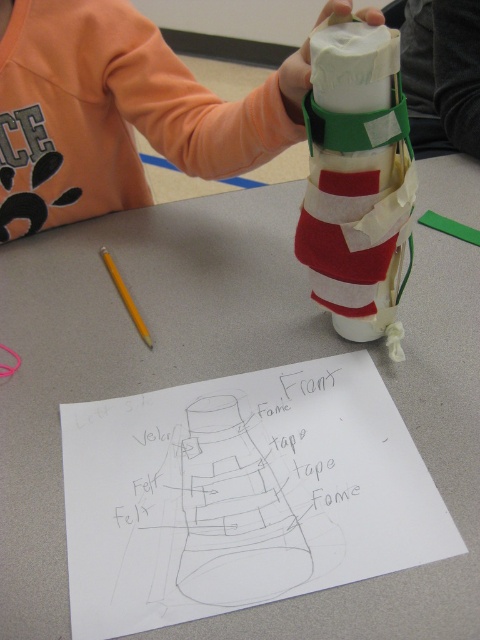
You are organizing a classroom supply closet. You have a shelf that can only hold items smaller than the yellow wood pencil at left. Can the white matte paper towel roll at center be placed on this shelf?

The white matte paper towel roll at center is bigger than the yellow wood pencil at left, so it cannot be placed on the shelf that only holds items smaller than the yellow wood pencil at left.

Based on the scene description, which object is positioned higher up between the white matte paper towel roll at center and the yellow wood pencil at left?

The white matte paper towel roll at center is positioned higher up than the yellow wood pencil at left.

You are a teacher observing a student working on a craft project. The student has a white matte paper towel roll at center and a yellow wood pencil at left. Which object is located to the left of the other?

The yellow wood pencil at left is located to the left of the white matte paper towel roll at center.